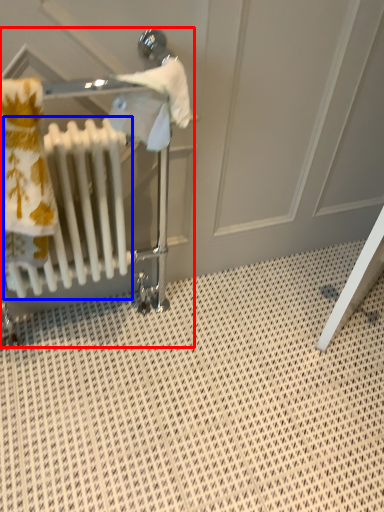
Question: Among these objects, which one is nearest to the camera, baby carriage (highlighted by a red box) or radiator (highlighted by a blue box)?

Choices:
 (A) baby carriage
 (B) radiator

Answer: (B)